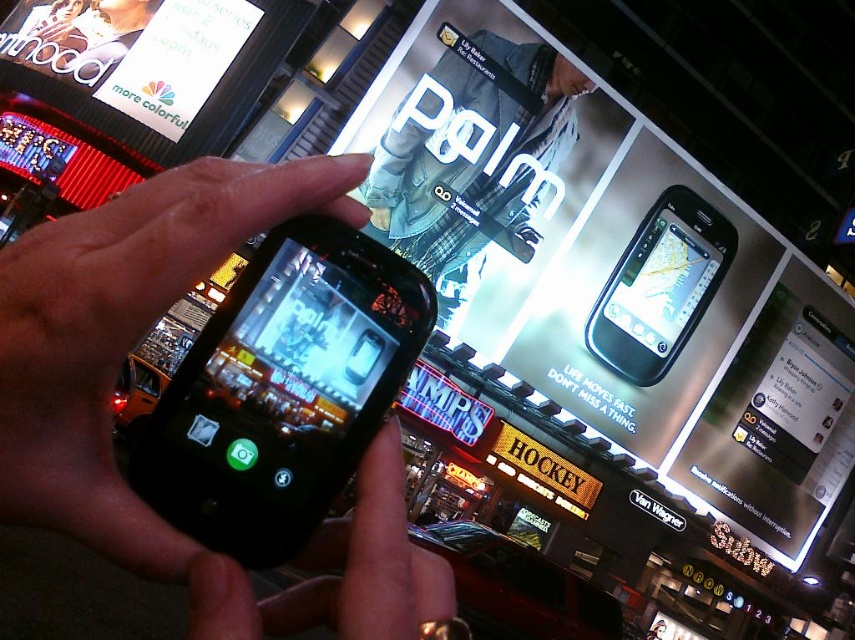
Does black matte phone at center have a lesser width compared to denim jacket at upper center?

Yes.

Is black matte phone at center smaller than denim jacket at upper center?

Yes, black matte phone at center is smaller than denim jacket at upper center.

Is point (54, 486) positioned after point (540, 195)?

No, (54, 486) is in front of (540, 195).

I want to click on black matte phone at center, so click(x=111, y=385).

Which is more to the right, denim jacket at upper center or black glossy phone at upper center?

Positioned to the right is black glossy phone at upper center.

Who is positioned more to the left, denim jacket at upper center or black glossy phone at upper center?

denim jacket at upper center

Who is more forward, [479,224] or [700,248]?

Positioned in front is point [479,224].

Find the location of a particular element. This screenshot has width=855, height=640. denim jacket at upper center is located at coordinates (473, 163).

Can you confirm if black matte phone at center is thinner than black glossy phone at upper center?

Yes, black matte phone at center is thinner than black glossy phone at upper center.

Who is more forward, (343,618) or (680,248)?

Point (343,618)

Who is more distant from viewer, [364,506] or [611,289]?

The point [611,289] is more distant.

Find the location of a particular element. black matte phone at center is located at coordinates (111, 385).